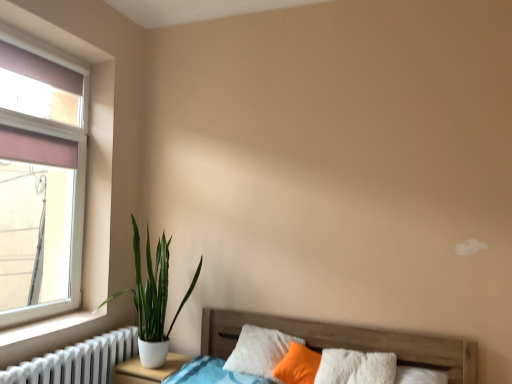
The image size is (512, 384). I want to click on vacant area on top of white smooth window sill at lower left (from a real-world perspective), so click(x=42, y=324).